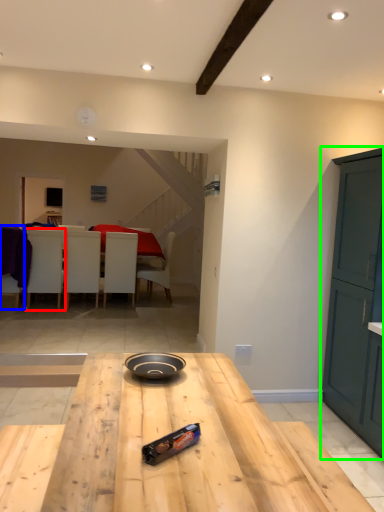
Question: Which object is the farthest from chair (highlighted by a red box)? Choose among these: chair (highlighted by a blue box) or cabinetry (highlighted by a green box).

Choices:
 (A) chair
 (B) cabinetry

Answer: (B)